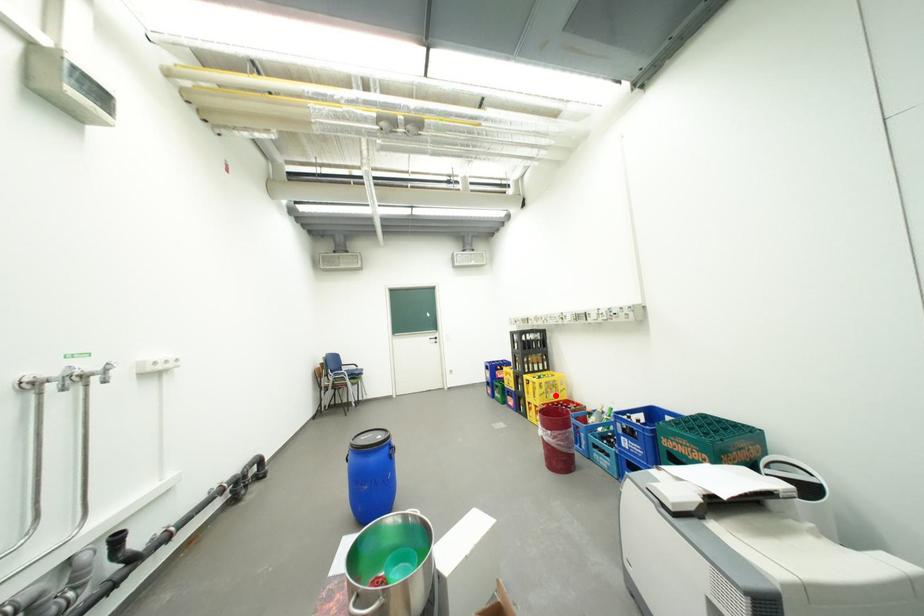
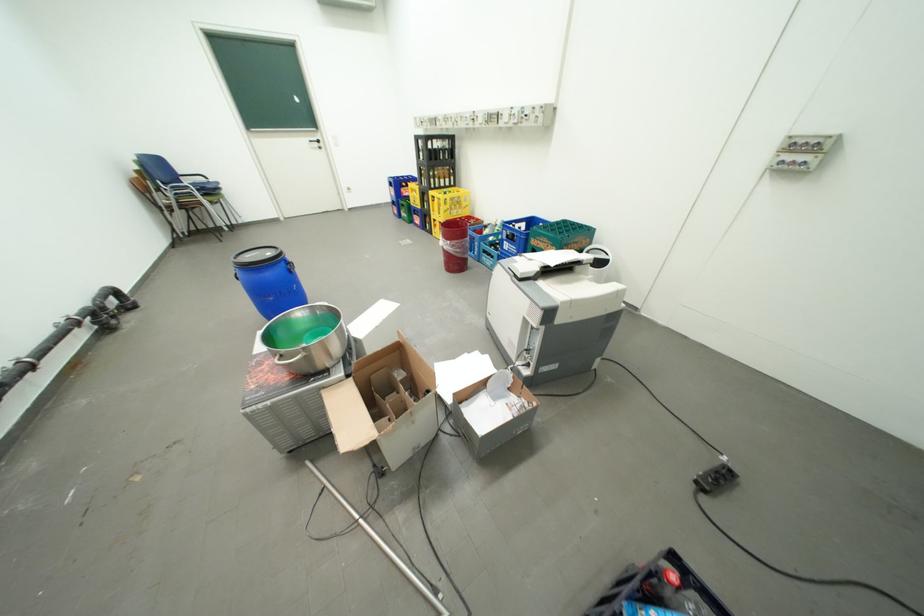
The point at the highlighted location is marked in the first image. Where is the corresponding point in the second image?

(459, 212)